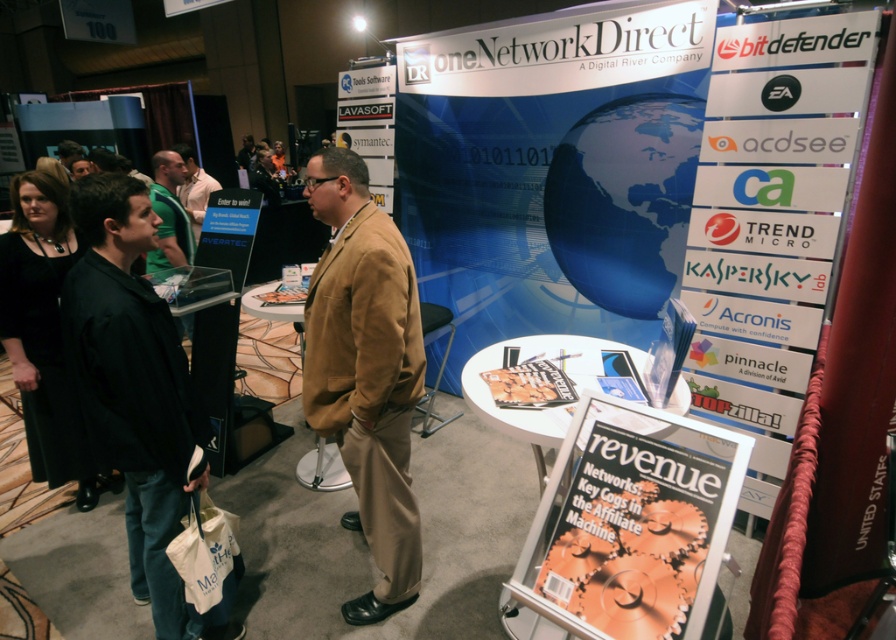
Question: Estimate the real-world distances between objects in this image. Which object is farther from the tan fabric jacket at center?

Choices:
 (A) matte white magazine at center
 (B) white plastic sign at upper center
 (C) green fabric shirt at upper left

Answer: (C)

Question: Considering the relative positions of white paper sign at right and white shirt at center in the image provided, where is white paper sign at right located with respect to white shirt at center?

Choices:
 (A) below
 (B) above

Answer: (A)

Question: In this image, where is white plastic sign at upper center located relative to green fabric shirt at upper left?

Choices:
 (A) below
 (B) above

Answer: (B)

Question: Which of the following is the farthest from the observer?

Choices:
 (A) 410,518
 (B) 392,86
 (C) 733,72
 (D) 194,170

Answer: (D)

Question: Does tan fabric jacket at center come behind matte white magazine at center?

Choices:
 (A) no
 (B) yes

Answer: (B)

Question: Which object is closer to the camera taking this photo?

Choices:
 (A) white paper sign at right
 (B) white shirt at center
 (C) green fabric shirt at upper left
 (D) tan fabric jacket at center

Answer: (D)